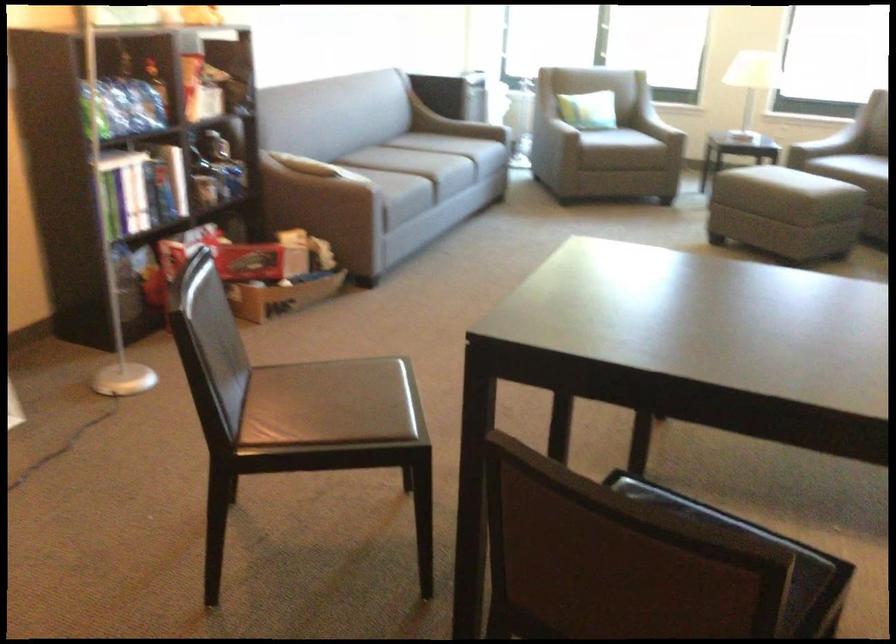
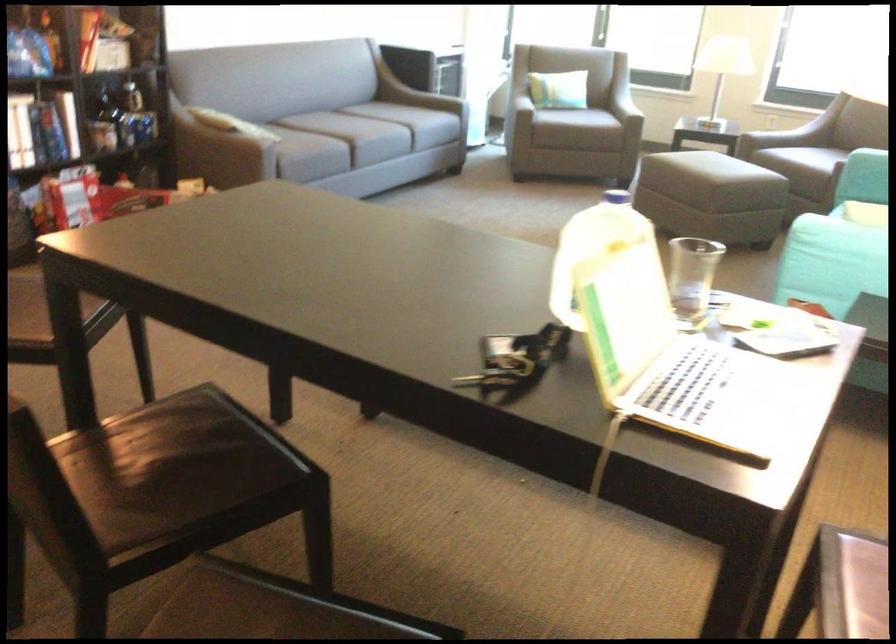
Question: Which direction would the cameraman need to move to produce the second image? Reply with the corresponding letter.

Choices:
 (A) Left
 (B) Right
 (C) Forward
 (D) Backward

Answer: (D)